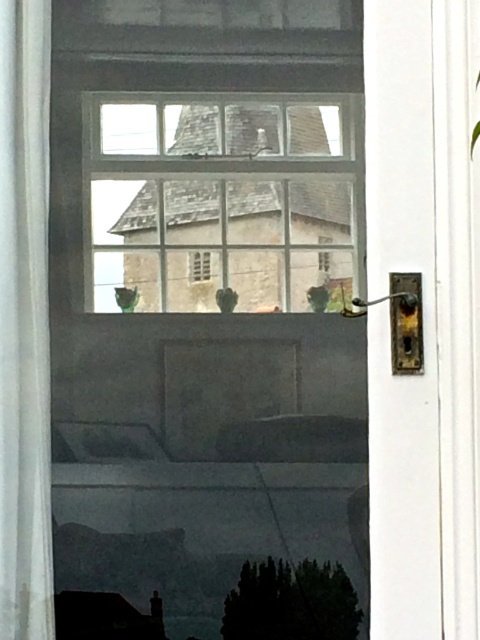
Question: Is white fabric curtain at left further to camera compared to green leafy plant at lower center?

Choices:
 (A) no
 (B) yes

Answer: (A)

Question: Among these points, which one is nearest to the camera?

Choices:
 (A) (402, 349)
 (B) (20, 3)
 (C) (311, 637)

Answer: (A)

Question: Which object appears farthest from the camera in this image?

Choices:
 (A) green leafy plant at lower center
 (B) white glossy screen door at right

Answer: (A)

Question: Can you confirm if white glossy screen door at right is thinner than clear glass window at upper center?

Choices:
 (A) yes
 (B) no

Answer: (A)

Question: Where is white glossy screen door at right located in relation to brass metallic door handle at right in the image?

Choices:
 (A) above
 (B) below

Answer: (A)

Question: Which point is farther from the camera taking this photo?

Choices:
 (A) (4, 17)
 (B) (420, 538)
 (C) (284, 131)

Answer: (C)